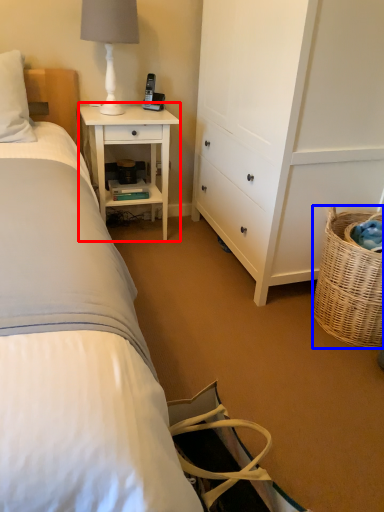
Question: Which of the following is the farthest to the observer, nightstand (highlighted by a red box) or picnic basket (highlighted by a blue box)?

Choices:
 (A) nightstand
 (B) picnic basket

Answer: (A)